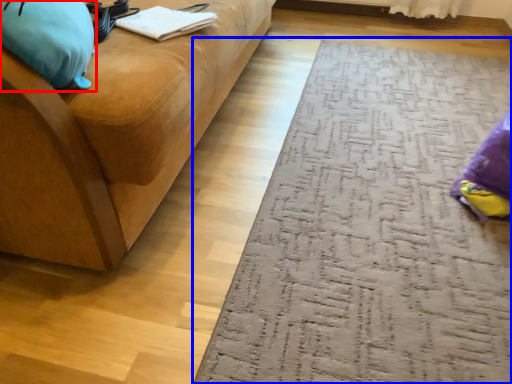
Question: Which of the following is the farthest to the observer, bean bag chair (highlighted by a red box) or doormat (highlighted by a blue box)?

Choices:
 (A) bean bag chair
 (B) doormat

Answer: (B)